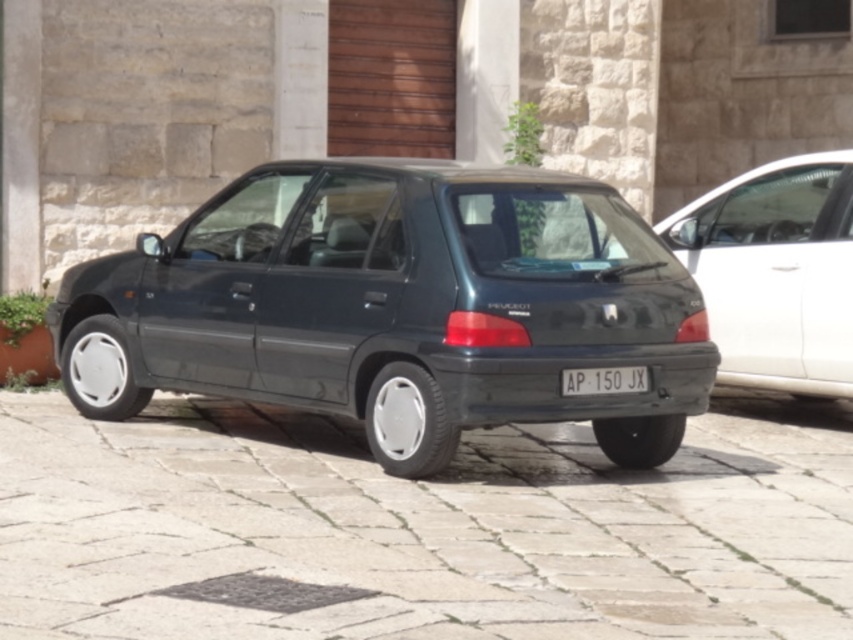
Question: Can you confirm if metallic gray hatchback at center is bigger than black plastic license plate at center?

Choices:
 (A) no
 (B) yes

Answer: (B)

Question: Which object is farther from the camera taking this photo?

Choices:
 (A) metallic gray hatchback at center
 (B) matte gray hatchback at center

Answer: (B)

Question: Is metallic gray hatchback at center to the left of matte gray hatchback at center from the viewer's perspective?

Choices:
 (A) yes
 (B) no

Answer: (A)

Question: Which object is farther from the camera taking this photo?

Choices:
 (A) metallic gray hatchback at center
 (B) gray stone pavement at center

Answer: (A)

Question: Does matte gray hatchback at center have a lesser width compared to black plastic license plate at center?

Choices:
 (A) no
 (B) yes

Answer: (A)

Question: Estimate the real-world distances between objects in this image. Which object is farther from the gray stone pavement at center?

Choices:
 (A) matte gray hatchback at center
 (B) metallic gray hatchback at center

Answer: (A)